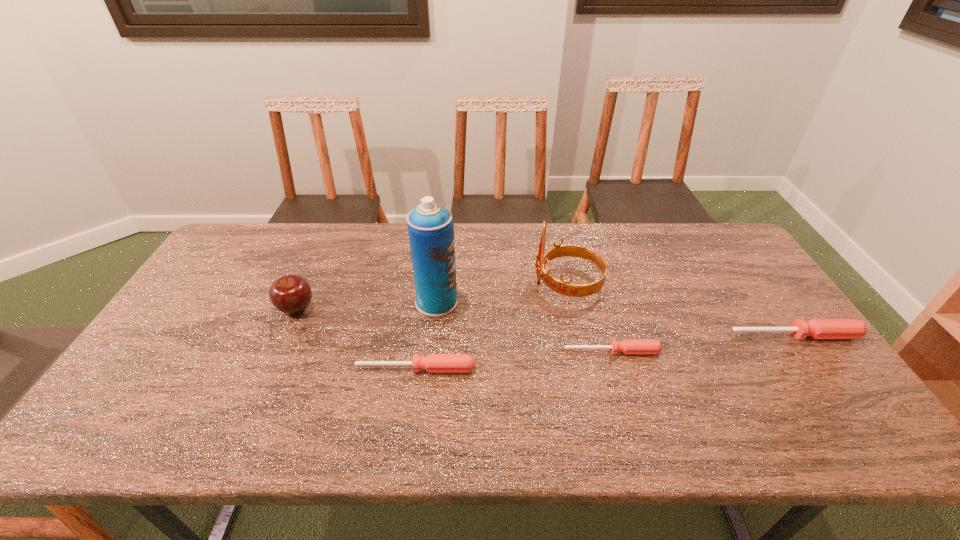
Identify the location of free space located on the back of the nearest screwdriver. (425, 298).

I want to click on blank space located on the back of the second farthest screwdriver, so click(602, 316).

Find the location of `free space located 0.140m on the back of the rightmost object`. free space located 0.140m on the back of the rightmost object is located at coordinates (765, 294).

Find the location of `free space located 0.130m on the front-facing side of the fifth shortest object`. free space located 0.130m on the front-facing side of the fifth shortest object is located at coordinates (490, 284).

Image resolution: width=960 pixels, height=540 pixels. I want to click on free location located on the front-facing side of the fifth shortest object, so click(421, 284).

At what (x,y) coordinates should I click in order to perform the action: click on free region located 0.330m on the front-facing side of the fifth shortest object. Please return your answer as a coordinate pair (x, y). The image size is (960, 540). Looking at the image, I should click on (425, 284).

Locate an element on the screen. Image resolution: width=960 pixels, height=540 pixels. free location located on the left of the leftmost object is located at coordinates (255, 308).

Identify the location of vacant space located 0.220m on the back of the aerosol can. (443, 244).

This screenshot has width=960, height=540. I want to click on object that is positioned at the far edge, so click(x=563, y=287).

This screenshot has width=960, height=540. Identify the location of object that is at the right edge. (816, 328).